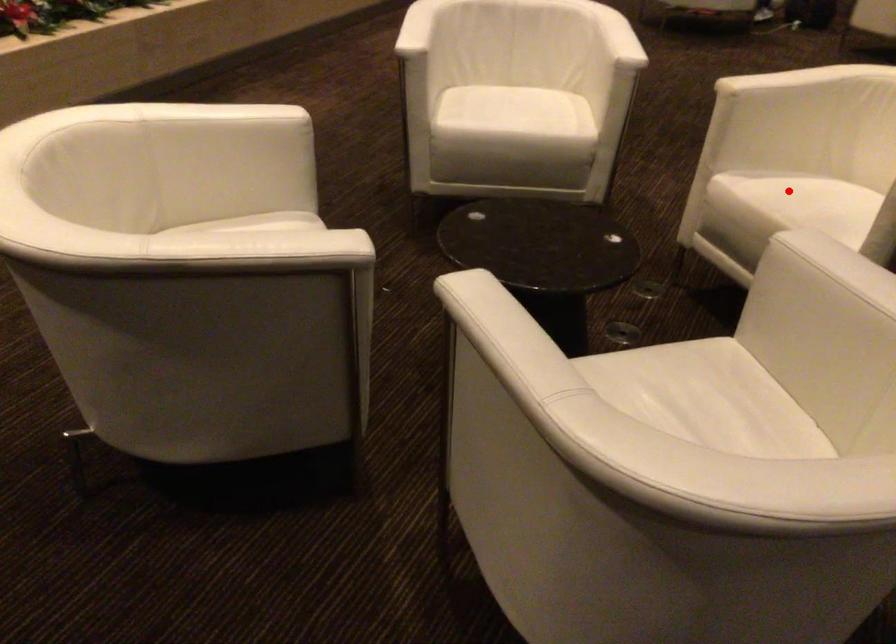
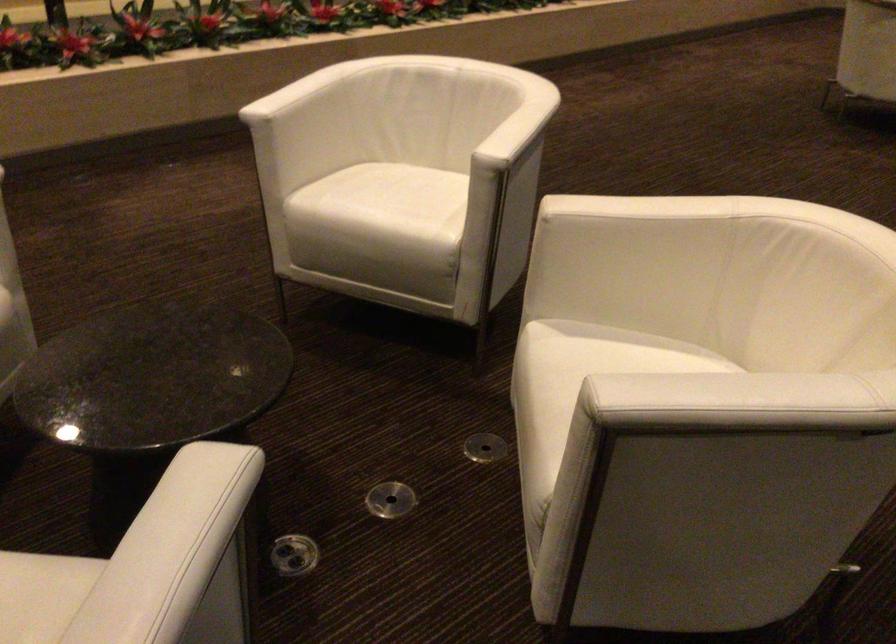
In the second image, find the point that corresponds to the highlighted location in the first image.

(581, 366)